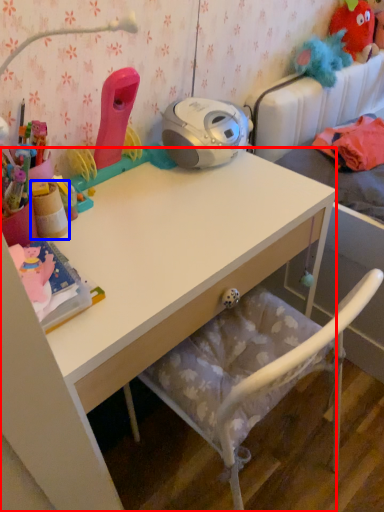
Question: Which object is further to the camera taking this photo, desk (highlighted by a red box) or stationery (highlighted by a blue box)?

Choices:
 (A) desk
 (B) stationery

Answer: (B)